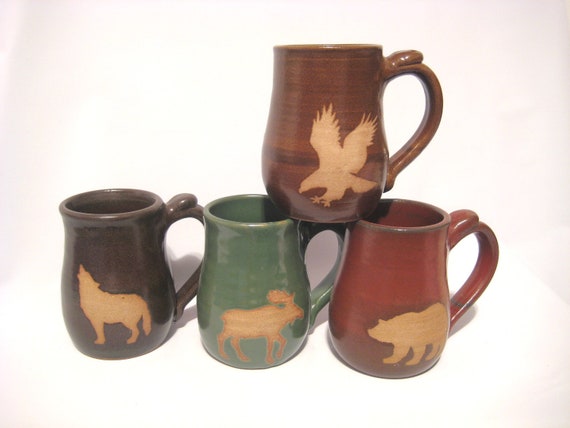
Image resolution: width=570 pixels, height=428 pixels. In order to click on handle in this screenshot , I will do `click(319, 293)`.